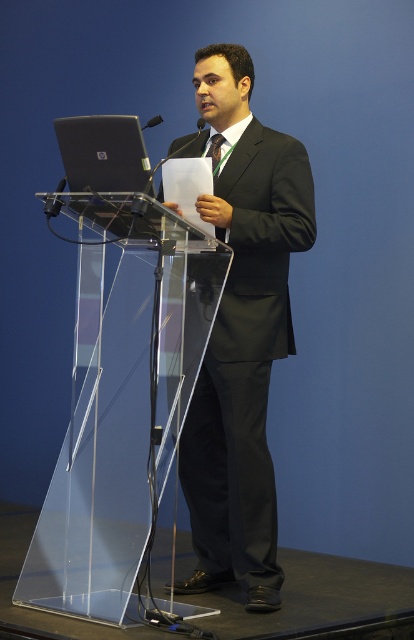
Question: Which of the following is the farthest from the observer?

Choices:
 (A) silver metallic laptop at upper left
 (B) green silk tie at center
 (C) black glossy suit at center

Answer: (B)

Question: From the image, what is the correct spatial relationship of black glossy suit at center in relation to silver metallic laptop at upper left?

Choices:
 (A) below
 (B) above

Answer: (A)

Question: Which object appears farthest from the camera in this image?

Choices:
 (A) green silk tie at center
 (B) silver metallic laptop at upper left
 (C) black glossy suit at center

Answer: (A)

Question: Estimate the real-world distances between objects in this image. Which object is farther from the green silk tie at center?

Choices:
 (A) silver metallic laptop at upper left
 (B) black glossy suit at center

Answer: (B)

Question: From the image, what is the correct spatial relationship of silver metallic laptop at upper left in relation to green silk tie at center?

Choices:
 (A) left
 (B) right

Answer: (A)

Question: Can you confirm if black glossy suit at center is thinner than green silk tie at center?

Choices:
 (A) no
 (B) yes

Answer: (A)